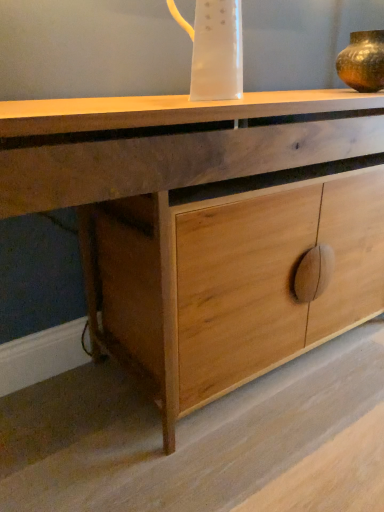
Image resolution: width=384 pixels, height=512 pixels. I want to click on vacant area that is in front of transparent plastic jug at upper center, so click(211, 102).